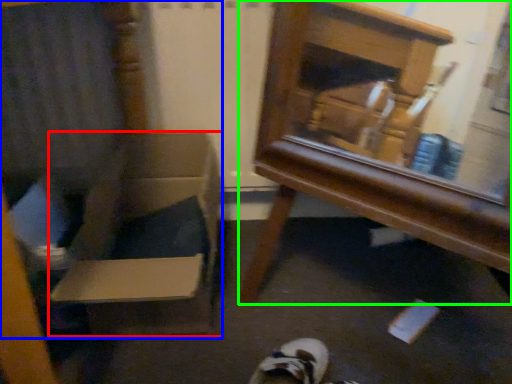
Question: Which object is the closest to the cardboard box (highlighted by a red box)? Choose among these: armchair (highlighted by a blue box) or furniture (highlighted by a green box).

Choices:
 (A) armchair
 (B) furniture

Answer: (A)